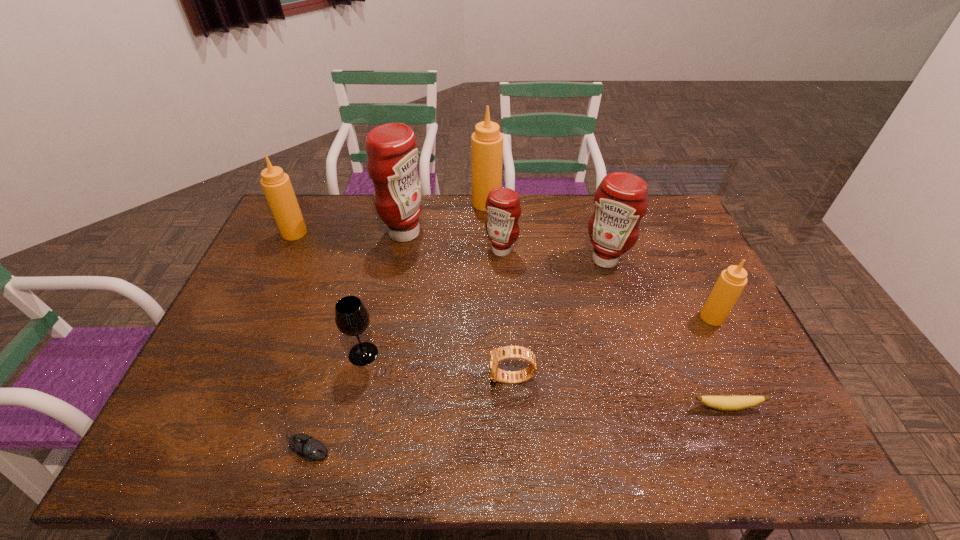
Locate which condiment is the sixth closest to the banana. Please provide its 2D coordinates. Your answer should be formatted as a tuple, i.e. [(x, y)], where the tuple contains the x and y coordinates of a point satisfying the conditions above.

[(277, 187)]

Image resolution: width=960 pixels, height=540 pixels. Identify the location of the second closest tan condiment to the computer mouse. (487, 141).

The width and height of the screenshot is (960, 540). What are the coordinates of `tan condiment that stands as the closest to the farthest object` in the screenshot? It's located at click(277, 187).

Find the location of a particular element. This screenshot has height=540, width=960. the second closest red condiment to the smallest red condiment is located at coordinates (621, 200).

This screenshot has height=540, width=960. Find the location of `red condiment that is the third closest one to the leftmost tan condiment`. red condiment that is the third closest one to the leftmost tan condiment is located at coordinates (621, 200).

The width and height of the screenshot is (960, 540). In order to click on vacant area in the image that satisfies the following two spatial constraints: 1. on the front side of the second tan condiment from right to left; 2. on the left side of the rightmost condiment in this screenshot , I will do `click(489, 317)`.

Locate an element on the screen. This screenshot has height=540, width=960. free space that satisfies the following two spatial constraints: 1. on the front side of the smallest red condiment; 2. on the left side of the second condiment from left to right is located at coordinates (401, 251).

Identify the location of free space that satisfies the following two spatial constraints: 1. on the front side of the third object from right to left; 2. on the face of the black watch. (640, 379).